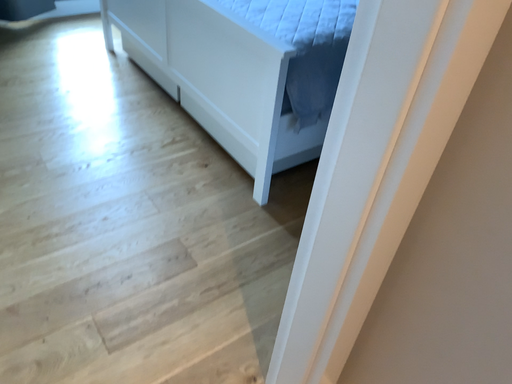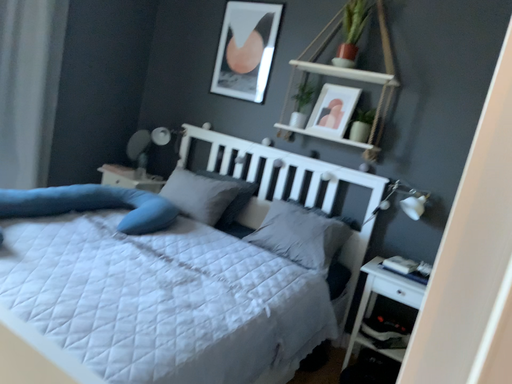
Question: Which way did the camera rotate in the video?

Choices:
 (A) rotated left
 (B) rotated right

Answer: (B)